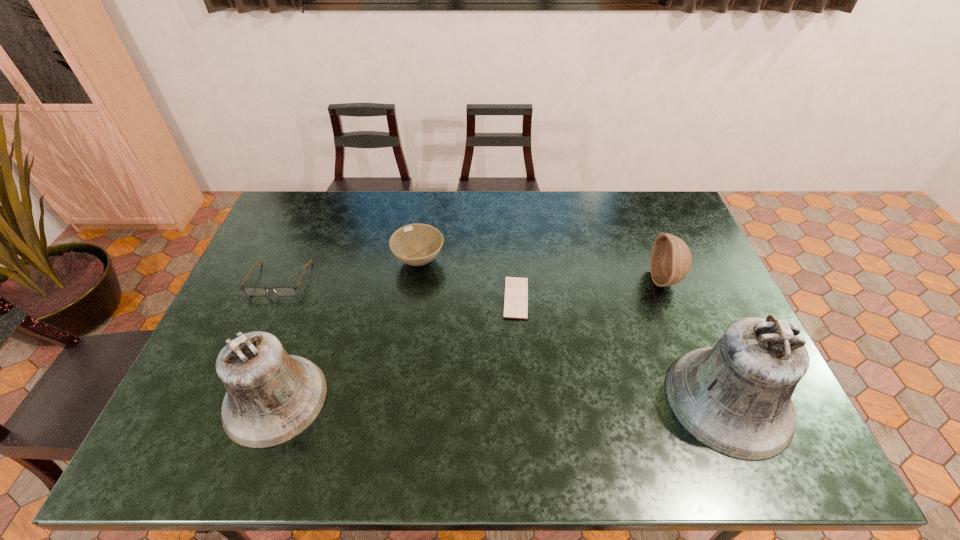
Identify the location of the shortest object. (516, 288).

Locate an element on the screen. This screenshot has width=960, height=540. vacant space located on the back of the fifth shortest object is located at coordinates (311, 300).

At what (x,y) coordinates should I click in order to perform the action: click on vacant region located 0.250m on the back of the tallest object. Please return your answer as a coordinate pair (x, y). The width and height of the screenshot is (960, 540). Looking at the image, I should click on (678, 283).

Where is `free space located on the right of the shorter bowl`? The image size is (960, 540). free space located on the right of the shorter bowl is located at coordinates (540, 261).

This screenshot has height=540, width=960. Find the location of `vacant space located 0.120m on the front-facing side of the second shortest object`. vacant space located 0.120m on the front-facing side of the second shortest object is located at coordinates (258, 328).

The width and height of the screenshot is (960, 540). I want to click on blank space located on the left of the right bowl, so click(x=636, y=280).

Identify the location of free space located on the right of the third object from right to left. click(626, 298).

Identify the location of bell that is at the left edge. (272, 397).

Identify the location of spectacles situated at the left edge. (251, 291).

At what (x,y) coordinates should I click in order to perform the action: click on bell that is positioned at the right edge. Please return your answer as a coordinate pair (x, y). Looking at the image, I should click on (735, 398).